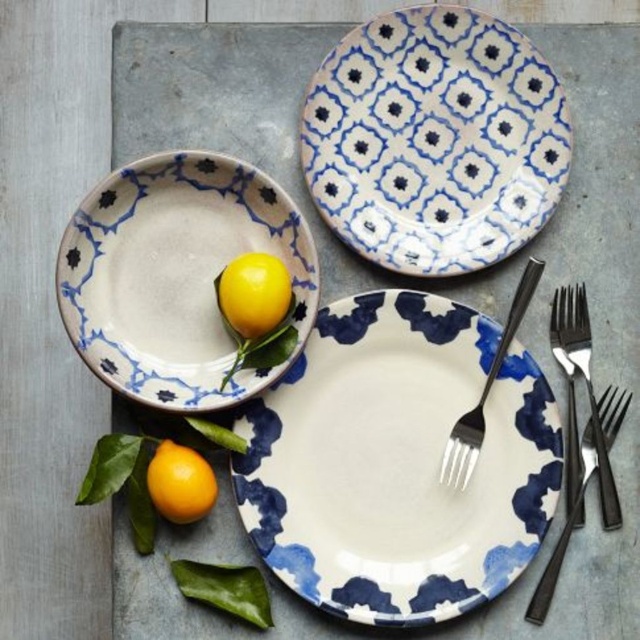
Is yellow matte lemon at center-left thinner than yellow matte lemon at lower left?

Incorrect, yellow matte lemon at center-left's width is not less than yellow matte lemon at lower left's.

The width and height of the screenshot is (640, 640). What do you see at coordinates (253, 294) in the screenshot?
I see `yellow matte lemon at center-left` at bounding box center [253, 294].

Identify the location of yellow matte lemon at center-left. This screenshot has width=640, height=640. (253, 294).

Which is behind, point (172, 376) or point (250, 314)?

The point (172, 376) is behind.

Between matte ceramic bowl at upper left and yellow matte lemon at center-left, which one has less height?

yellow matte lemon at center-left

The image size is (640, 640). What do you see at coordinates (176, 275) in the screenshot? I see `matte ceramic bowl at upper left` at bounding box center [176, 275].

At what (x,y) coordinates should I click in order to perform the action: click on matte ceramic bowl at upper left. Please return your answer as a coordinate pair (x, y). The height and width of the screenshot is (640, 640). Looking at the image, I should click on (176, 275).

Does white glossy plate at center come in front of black metallic fork at center?

Yes, it is in front of black metallic fork at center.

Does point (266, 490) come farther from viewer compared to point (470, 465)?

Yes, it is behind point (470, 465).

Does point (550, 401) lie in front of point (481, 426)?

Yes, it is.

Locate an element on the screen. Image resolution: width=640 pixels, height=640 pixels. white glossy plate at center is located at coordinates (397, 461).